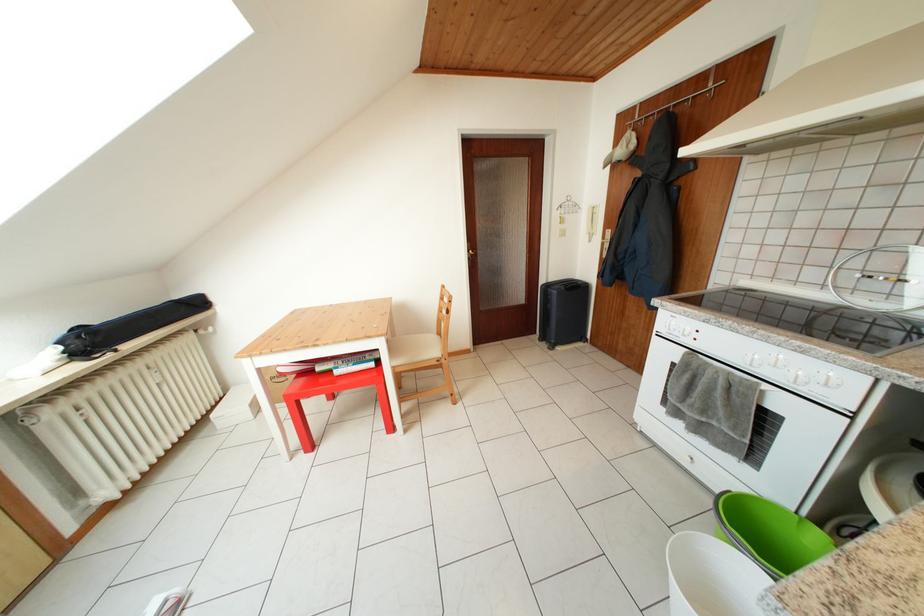
At what (x,y) coordinates should I click in order to perform the action: click on metal coat hook. Please return your answer as a coordinate pair (x, y). This screenshot has width=924, height=616. Looking at the image, I should click on (676, 100).